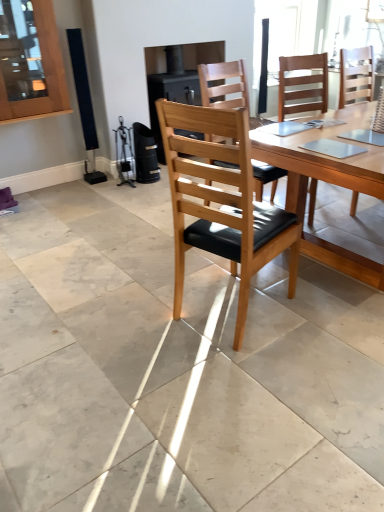
The height and width of the screenshot is (512, 384). What are the coordinates of `free area below wooden chair with black cushion at center, the first chair viewed from the front (from a real-world perspective)` in the screenshot? It's located at (233, 311).